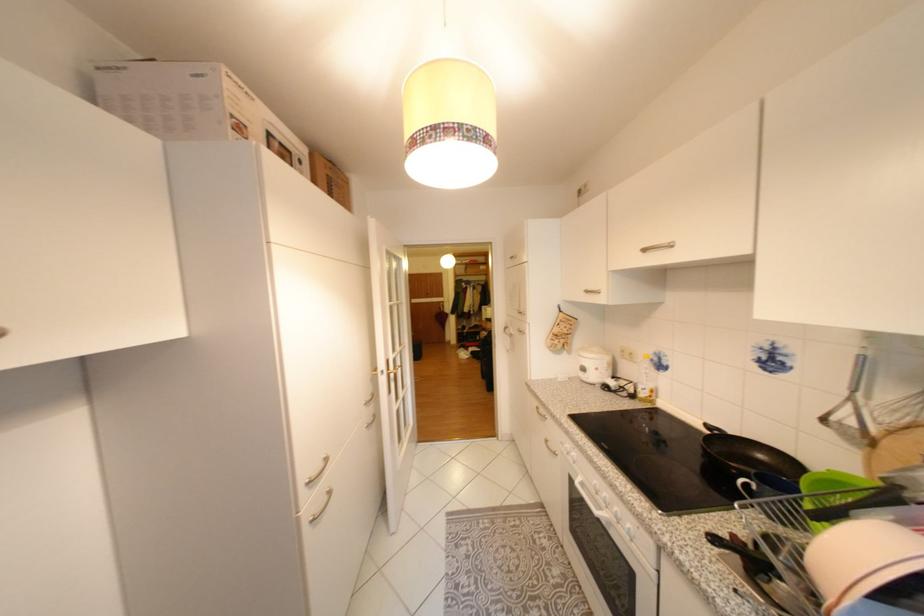
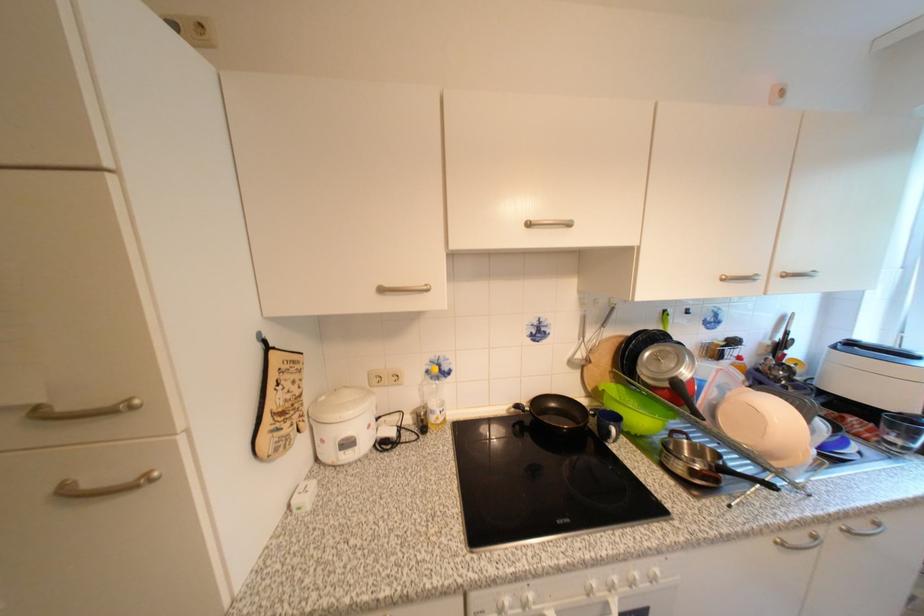
Where in the second image is the point corresponding to point 596,292 from the first image?

(391, 291)